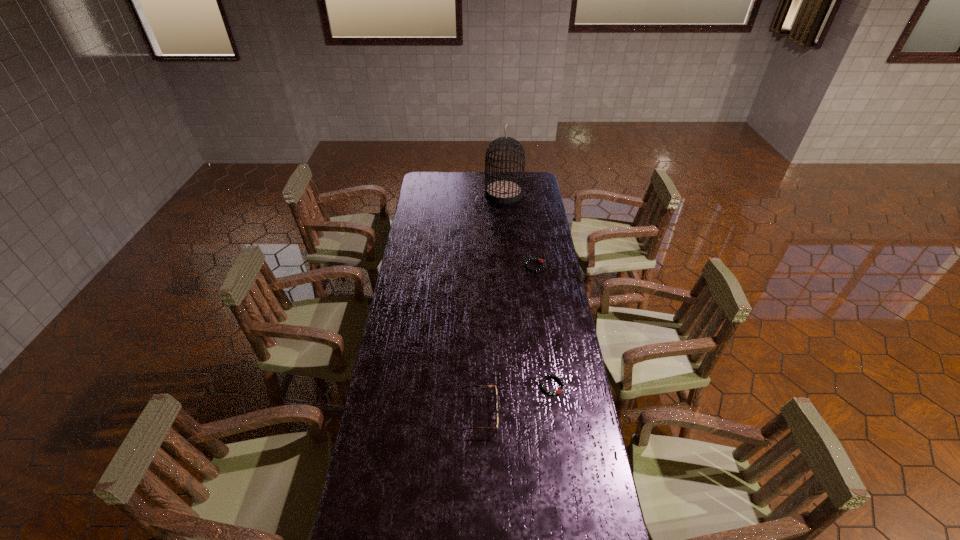
The image size is (960, 540). I want to click on object that stands as the closest to the nearer bracelet, so click(479, 386).

You are a GUI agent. You are given a task and a screenshot of the screen. Output one action in this format:
    pyautogui.click(x=<x>, y=<y>)
    Task: Click on the object that ranks as the third closest to the farther bracelet
    
    Given the screenshot: What is the action you would take?
    pyautogui.click(x=479, y=386)

Identify which bracelet is the closest to the second tallest object. Please provide its 2D coordinates. Your answer should be formatted as a tuple, i.e. [(x, y)], where the tuple contains the x and y coordinates of a point satisfying the conditions above.

[(558, 391)]

Identify which bracelet is located as the second nearest to the tallest object. Please provide its 2D coordinates. Your answer should be formatted as a tuple, i.e. [(x, y)], where the tuple contains the x and y coordinates of a point satisfying the conditions above.

[(558, 391)]

This screenshot has width=960, height=540. Find the location of `vacant space that satisfies the following two spatial constraints: 1. on the front side of the farther bracelet; 2. on the left side of the birdcage`. vacant space that satisfies the following two spatial constraints: 1. on the front side of the farther bracelet; 2. on the left side of the birdcage is located at coordinates (509, 266).